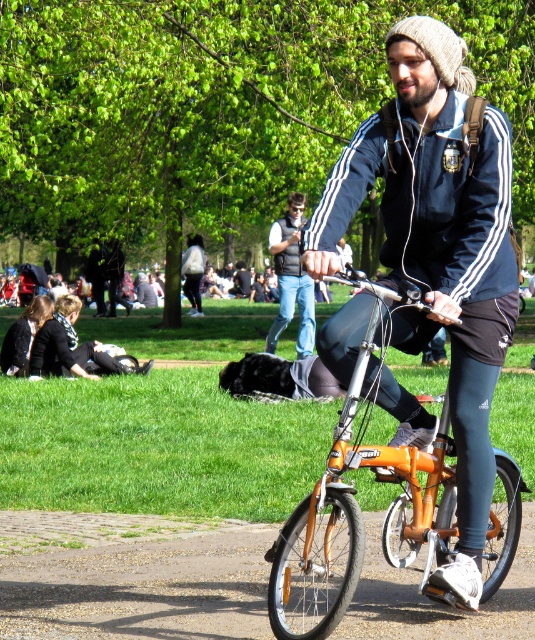
You are a photographer trying to capture a candid shot of the denim jeans at center and the black fabric jacket at lower left. Since you want to ensure both are clearly visible in the frame, which object should you focus on to ensure proper depth of field?

You should focus on the denim jeans at center because it is larger in size than the black fabric jacket at lower left, so focusing on the larger object will help ensure both are in focus.

You are a photographer trying to capture a candid shot of the denim jeans at center and the black fabric bag at center. Since you want to ensure both are clearly visible in the frame, which object should you focus on to account for their size difference?

The denim jeans at center is wider than the black fabric bag at center, so focusing on the denim jeans at center would ensure both are clearly visible in the frame due to its larger size.

You are standing at point (181, 262) and want to walk to point (303, 292). Is the destination point in front of or behind you?

The destination point (303, 292) is in front of your current position at point (181, 262).